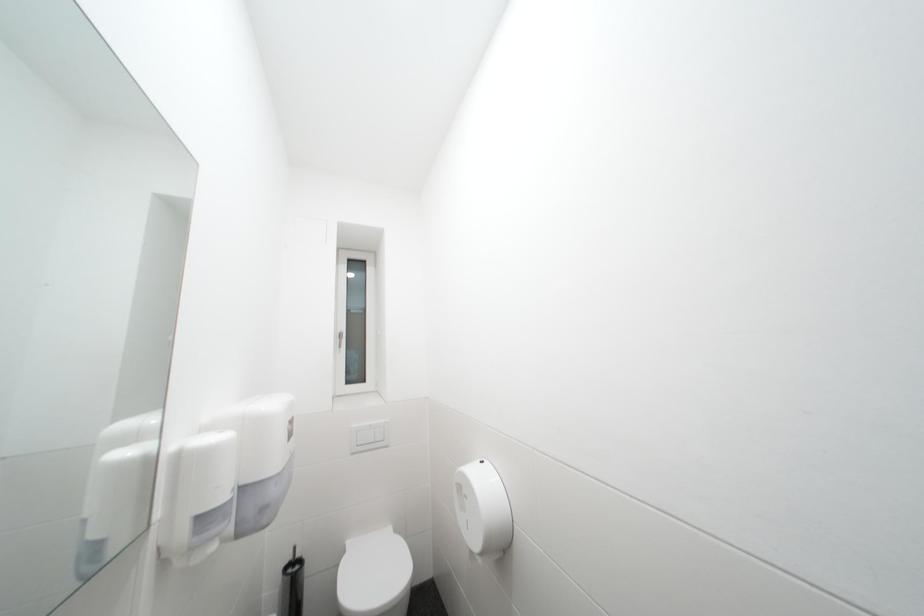
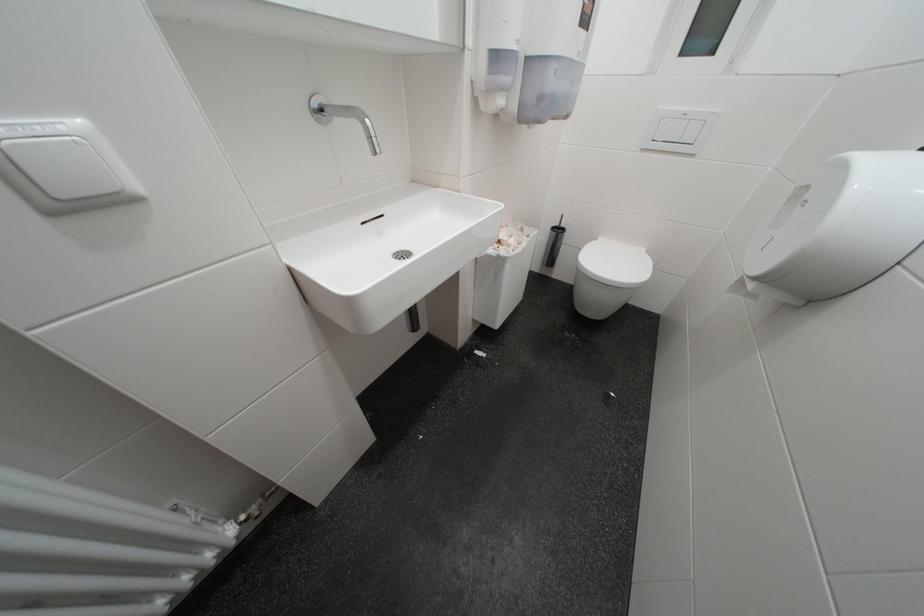
The first image is from the beginning of the video and the second image is from the end. How did the camera likely rotate when shooting the video?

The rotation direction of the camera is left-down.